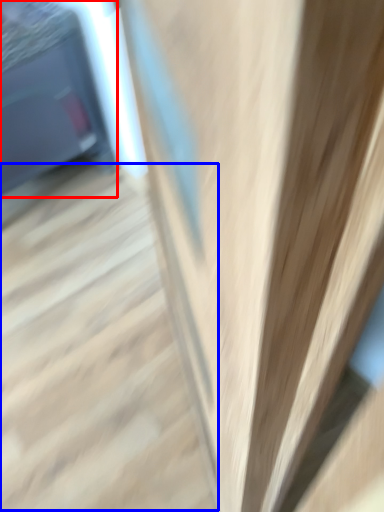
Question: Which object is closer to the camera taking this photo, furniture (highlighted by a red box) or stairs (highlighted by a blue box)?

Choices:
 (A) furniture
 (B) stairs

Answer: (B)